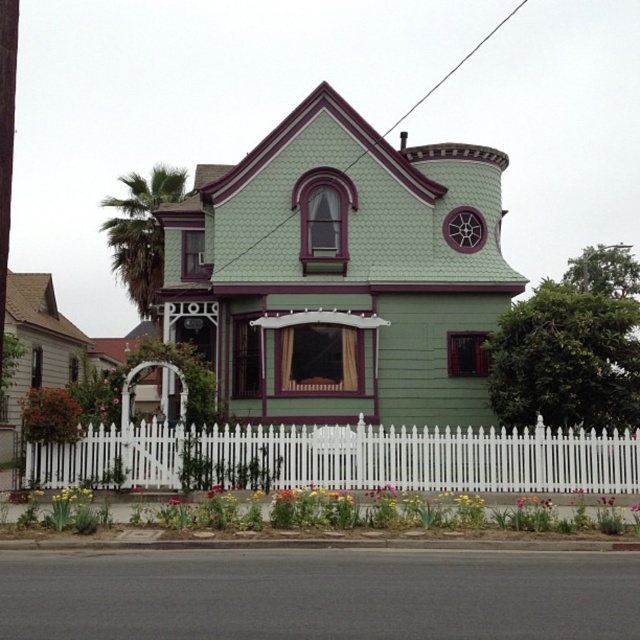
Who is positioned more to the left, white picket fence at lower center or green leafy palm tree at left?

green leafy palm tree at left

Between white picket fence at lower center and green leafy palm tree at left, which one appears on the right side from the viewer's perspective?

From the viewer's perspective, white picket fence at lower center appears more on the right side.

Does point (442, 474) come behind point (109, 237)?

No, it is not.

You are a GUI agent. You are given a task and a screenshot of the screen. Output one action in this format:
    pyautogui.click(x=<x>, y=<y>)
    Task: Click on the white picket fence at lower center
    The image size is (640, 640).
    Given the screenshot: What is the action you would take?
    tap(342, 458)